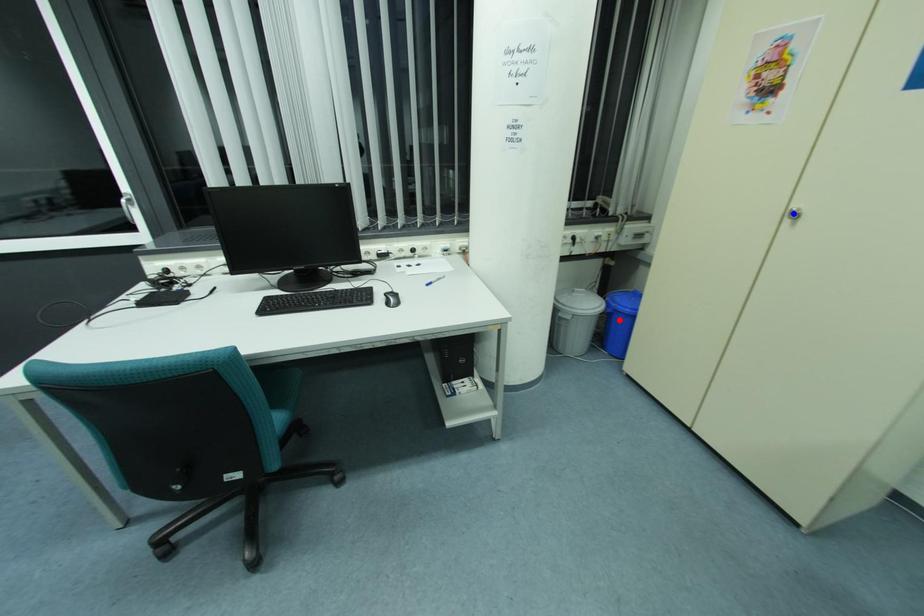
Question: In the image, two points are highlighted. Which point is nearer to the camera? Reply with the corresponding letter.

Choices:
 (A) blue point
 (B) red point

Answer: (A)